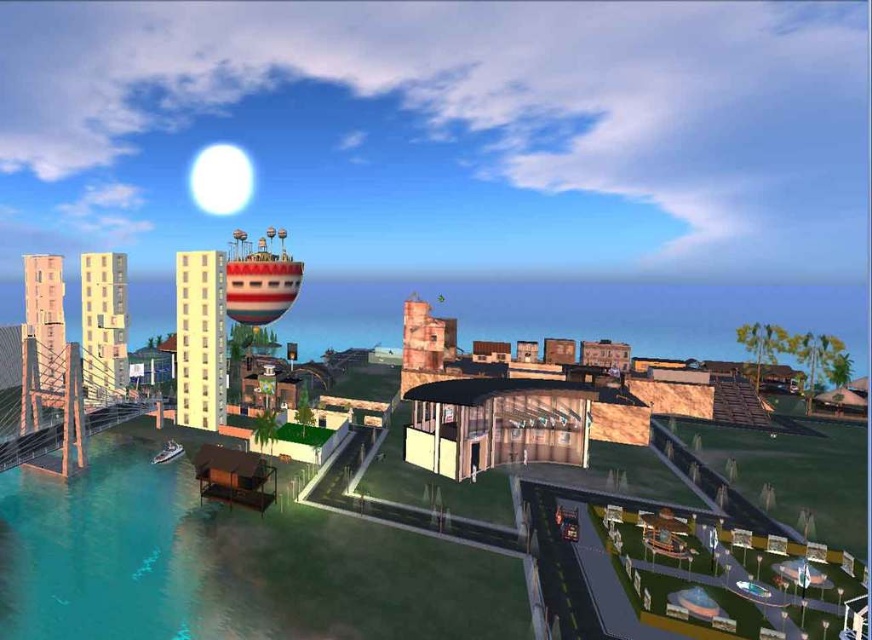
You are standing on the dock and see the clear blue water at lower left and the metallic silver boat at lower left. Which object is closer to you?

The metallic silver boat at lower left is closer to you because the clear blue water at lower left is located below it.